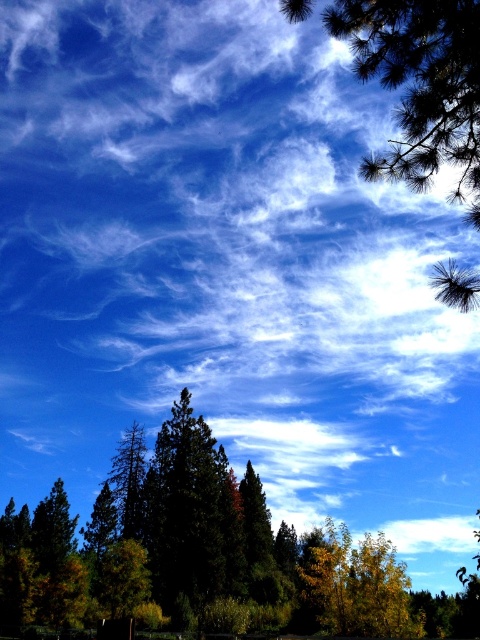
Question: Is dark green trees at center below green matte tree at center?

Choices:
 (A) yes
 (B) no

Answer: (A)

Question: Which point is closer to the camera?

Choices:
 (A) green matte tree at center
 (B) dark green trees at center
 (C) green needle-like at upper right
 (D) dark green pine at center

Answer: (C)

Question: From the image, what is the correct spatial relationship of green needle-like at upper right in relation to green matte tree at center?

Choices:
 (A) above
 (B) below

Answer: (A)

Question: Which of the following is the closest to the observer?

Choices:
 (A) dark green trees at center
 (B) green needle-like at upper right
 (C) green matte tree at center

Answer: (B)

Question: Which object is positioned closest to the green matte tree at center?

Choices:
 (A) dark green trees at center
 (B) green needle-like at upper right

Answer: (A)

Question: Is dark green pine at center closer to the viewer compared to green matte tree at center?

Choices:
 (A) yes
 (B) no

Answer: (A)